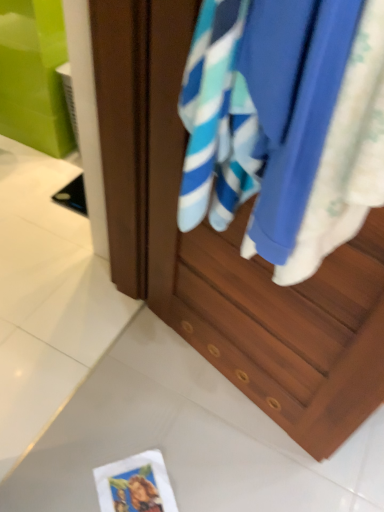
Find the location of `free space above white paper postcard at lower center (from a real-world perspective)`. free space above white paper postcard at lower center (from a real-world perspective) is located at coordinates (139, 487).